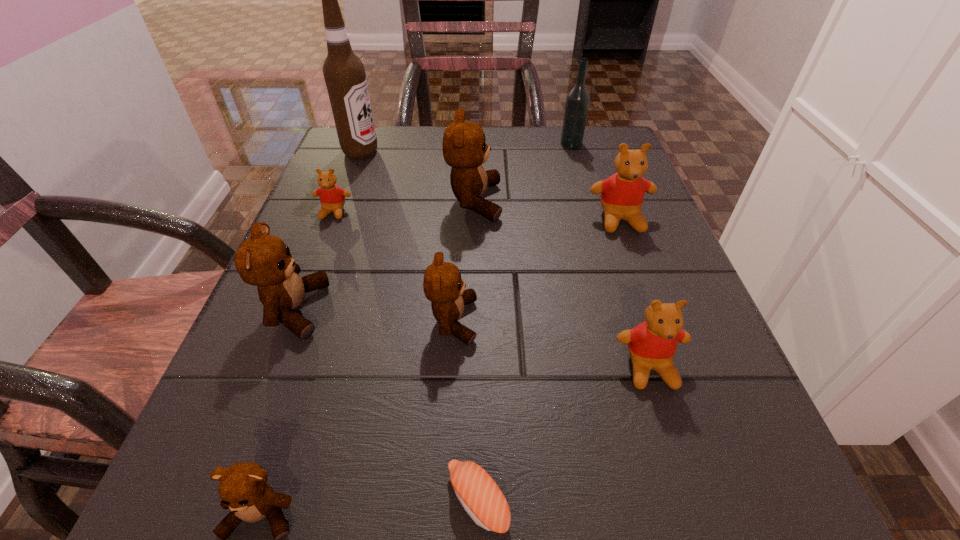
You are a GUI agent. You are given a task and a screenshot of the screen. Output one action in this format:
    pyautogui.click(x=<x>, y=<y>)
    Task: Click on the object that stands as the second closest to the alcohol
    
    Given the screenshot: What is the action you would take?
    pyautogui.click(x=464, y=149)

Identify which object is the eighth closest to the nearest brown teddy bear. Please provide its 2D coordinates. Your answer should be formatted as a tuple, i.e. [(x, y)], where the tuple contains the x and y coordinates of a point satisfying the conditions above.

[(344, 73)]

Point out which teddy bear is positioned as the third nearest to the black vodka. Please provide its 2D coordinates. Your answer should be formatted as a tuple, i.e. [(x, y)], where the tuple contains the x and y coordinates of a point satisfying the conditions above.

[(332, 198)]

Locate an element on the screen. teddy bear that is the sixth closest to the alcohol is located at coordinates (652, 344).

Identify which brown teddy bear is located as the nearest to the shortest object. Please provide its 2D coordinates. Your answer should be formatted as a tuple, i.e. [(x, y)], where the tuple contains the x and y coordinates of a point satisfying the conditions above.

[(243, 488)]

At what (x,y) coordinates should I click in order to perform the action: click on brown teddy bear that stands as the second closest to the third biggest brown teddy bear. Please return your answer as a coordinate pair (x, y). The height and width of the screenshot is (540, 960). Looking at the image, I should click on (464, 149).

Locate which red teddy bear ranks in proximity to the nearest brown teddy bear. Please provide its 2D coordinates. Your answer should be formatted as a tuple, i.e. [(x, y)], where the tuple contains the x and y coordinates of a point satisfying the conditions above.

[(652, 344)]

Identify which red teddy bear is the second closest to the biggest red teddy bear. Please provide its 2D coordinates. Your answer should be formatted as a tuple, i.e. [(x, y)], where the tuple contains the x and y coordinates of a point satisfying the conditions above.

[(332, 198)]

Locate an element on the screen. free space that satisfies the following two spatial constraints: 1. on the label of the alcohol; 2. on the front-facing side of the leftmost red teddy bear is located at coordinates (338, 212).

Locate an element on the screen. The width and height of the screenshot is (960, 540). free space that satisfies the following two spatial constraints: 1. on the back side of the salmon sushi; 2. on the label of the tallest object is located at coordinates (479, 152).